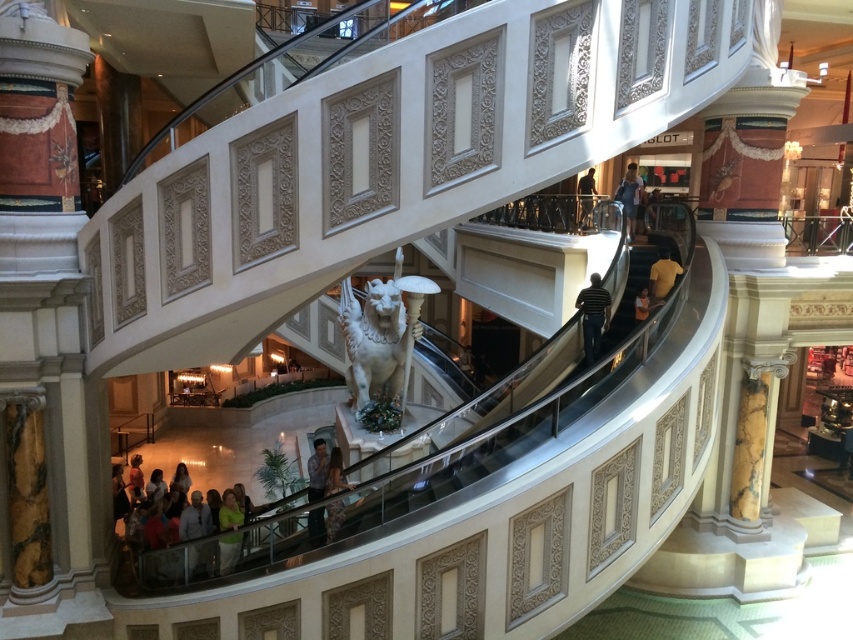
Between green matte shirt at lower center and yellow cotton shirt at upper right, which one has more height?

yellow cotton shirt at upper right

Between green matte shirt at lower center and yellow cotton shirt at upper right, which one appears on the left side from the viewer's perspective?

Positioned to the left is green matte shirt at lower center.

The height and width of the screenshot is (640, 853). Describe the element at coordinates (229, 531) in the screenshot. I see `green matte shirt at lower center` at that location.

The width and height of the screenshot is (853, 640). Find the location of `green matte shirt at lower center`. green matte shirt at lower center is located at coordinates click(229, 531).

Is point (628, 212) in front of point (659, 298)?

That is False.

This screenshot has height=640, width=853. What do you see at coordinates (630, 196) in the screenshot?
I see `blue denim jeans at upper right` at bounding box center [630, 196].

Locate an element on the screen. blue denim jeans at upper right is located at coordinates (630, 196).

Which is in front, point (178, 493) or point (660, 304)?

Point (660, 304) is in front.

Consider the image. Does light green fabric at lower center have a greater width compared to orange fabric shirt at upper right?

Yes.

Between point (184, 506) and point (641, 310), which one is positioned in front?

Point (641, 310)

Identify the location of light green fabric at lower center. This screenshot has height=640, width=853. (189, 536).